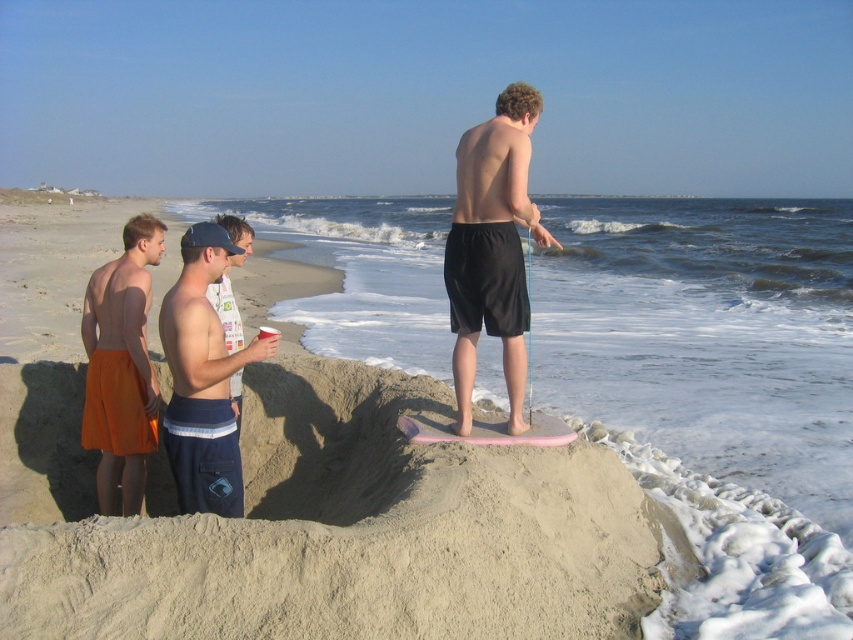
You are standing at the center of the beach and want to build a sandcastle. The beige sandcastle at center is already there. Where should you go to build your own sandcastle?

The beige sandcastle at center is located at point (715, 390), so you should go to a different location to build your own sandcastle.